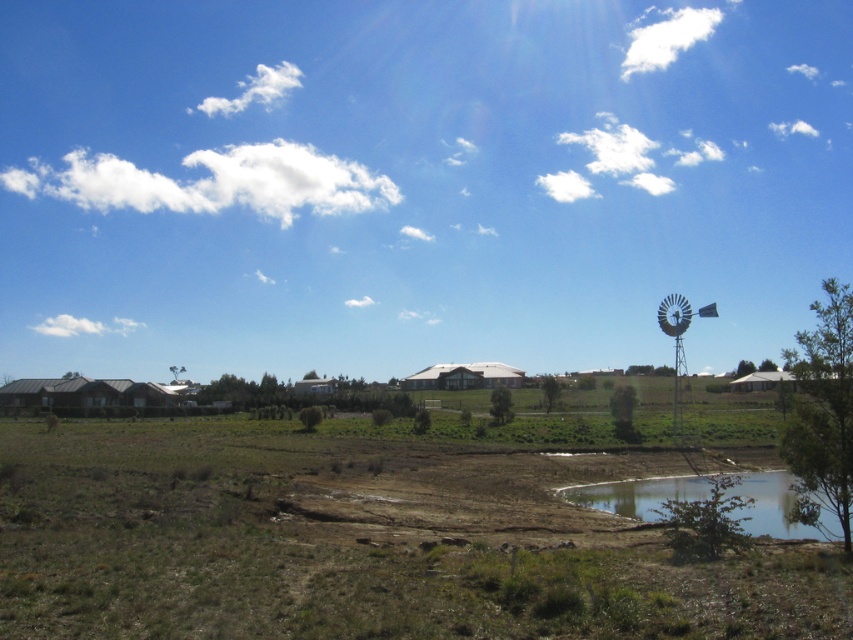
Question: In this image, where is green grassy field at center located relative to clear glass pond at lower right?

Choices:
 (A) below
 (B) above

Answer: (A)

Question: Which object is farther from the camera taking this photo?

Choices:
 (A) green grassy field at center
 (B) clear glass pond at lower right

Answer: (B)

Question: Can you confirm if green grassy field at center is smaller than clear glass pond at lower right?

Choices:
 (A) yes
 (B) no

Answer: (B)

Question: In this image, where is green grassy field at center located relative to clear glass pond at lower right?

Choices:
 (A) right
 (B) left

Answer: (B)